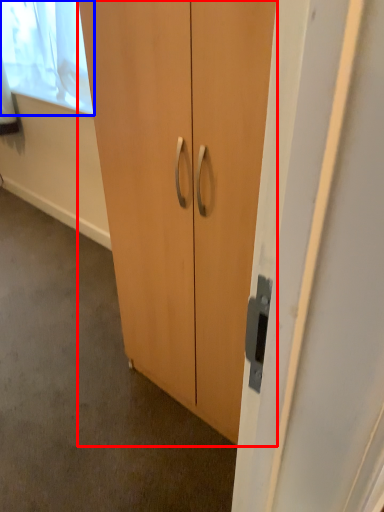
Question: Which of the following is the farthest to the observer, cupboard (highlighted by a red box) or window screen (highlighted by a blue box)?

Choices:
 (A) cupboard
 (B) window screen

Answer: (B)